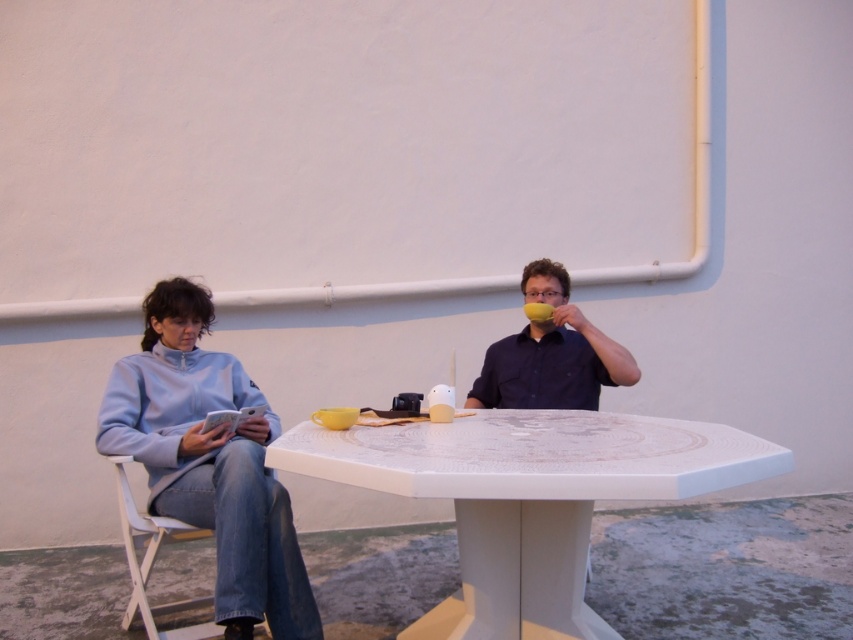
You are a photographer trying to capture a candid shot of the two people at the table. You want to ensure that both the light blue fleece jacket at left and the white plastic chair at lower left are clearly visible in the frame. Given their sizes, which object should you focus on first to ensure they are both in focus?

The light blue fleece jacket at left is bigger than the white plastic chair at lower left, so you should focus on the light blue fleece jacket at left first to ensure both are in focus, as larger objects often require more precise focusing to maintain clarity.

You are a tailor measuring fabrics for alterations. You have a piece of fabric that is exactly the same width as the white plastic chair at lower left. Can you use this fabric to make a new jacket for the person wearing the light blue fleece jacket at left without needing to adjust the pattern?

The light blue fleece jacket at left is wider than the white plastic chair at lower left. Since the fabric is only as wide as the chair, it may not be sufficient to accommodate the jacket without adjustments. You should consider using a wider fabric or altering the pattern to fit the available width.